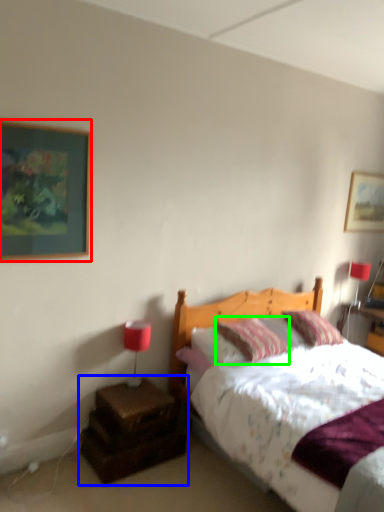
Question: Estimate the real-world distances between objects in this image. Which object is farther from picture frame (highlighted by a red box), nightstand (highlighted by a blue box) or pillow (highlighted by a green box)?

Choices:
 (A) nightstand
 (B) pillow

Answer: (B)